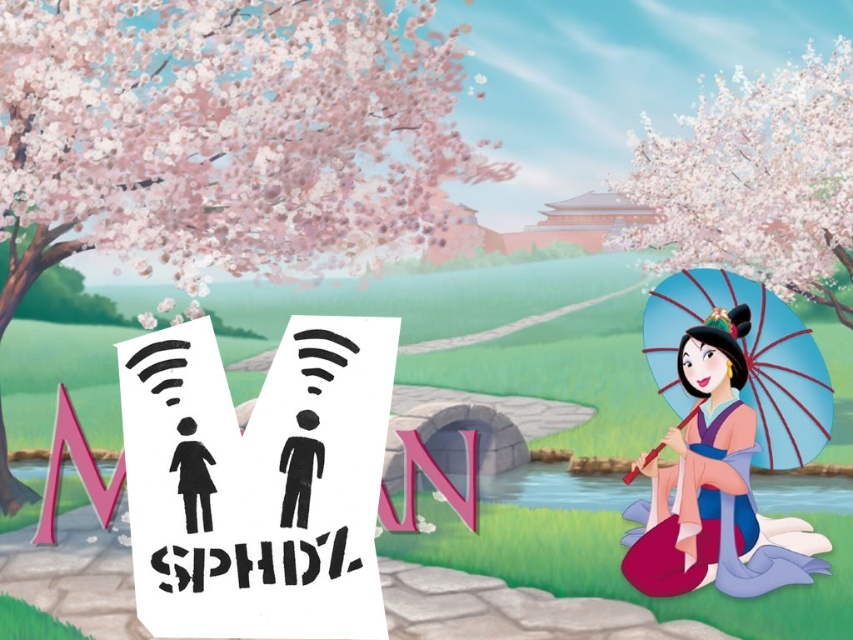
Is black paper sign at center taller than black matte figure at center?

Correct, black paper sign at center is much taller as black matte figure at center.

The image size is (853, 640). What are the coordinates of `black paper sign at center` in the screenshot? It's located at (257, 481).

Which is above, black paper sign at center or matte blue umbrella at right?

matte blue umbrella at right is higher up.

Who is shorter, black paper sign at center or matte blue umbrella at right?

With less height is black paper sign at center.

Is point (323, 540) positioned before point (729, 282)?

Yes.

Image resolution: width=853 pixels, height=640 pixels. In order to click on black paper sign at center in this screenshot , I will do `click(257, 481)`.

Does matte blue umbrella at right appear on the left side of black paper at center?

No, matte blue umbrella at right is not to the left of black paper at center.

Which is above, matte blue umbrella at right or black paper at center?

matte blue umbrella at right

What do you see at coordinates (744, 358) in the screenshot?
I see `matte blue umbrella at right` at bounding box center [744, 358].

At what (x,y) coordinates should I click in order to perform the action: click on matte blue umbrella at right. Please return your answer as a coordinate pair (x, y). Looking at the image, I should click on (744, 358).